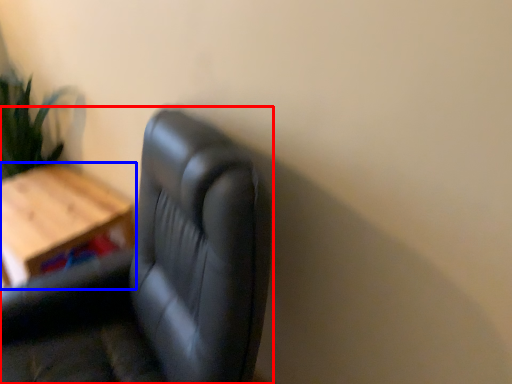
Question: Which point is closer to the camera, chair (highlighted by a red box) or table (highlighted by a blue box)?

Choices:
 (A) chair
 (B) table

Answer: (A)